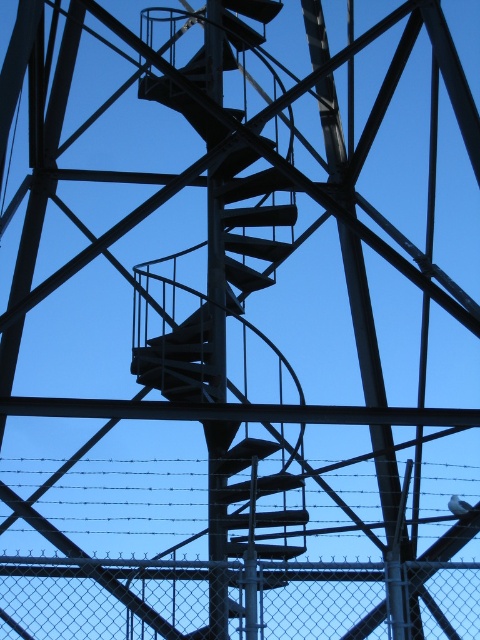
Is metallic spiral staircase at center behind barbed wire at center?

No.

Is metallic spiral staircase at center taller than barbed wire at center?

Yes, metallic spiral staircase at center is taller than barbed wire at center.

You are a GUI agent. You are given a task and a screenshot of the screen. Output one action in this format:
    pyautogui.click(x=<x>, y=<y>)
    Task: Click on the metallic spiral staircase at center
    The image size is (480, 640).
    Given the screenshot: What is the action you would take?
    pyautogui.click(x=218, y=289)

Which is more to the right, chain link fence at lower center or barbed wire at center?

chain link fence at lower center is more to the right.

Does chain link fence at lower center have a lesser width compared to barbed wire at center?

Yes.

Between point (477, 604) and point (192, 490), which one is positioned behind?

The point (192, 490) is behind.

Locate an element on the screen. chain link fence at lower center is located at coordinates (108, 593).

Between metallic spiral staircase at center and chain link fence at center, which one appears on the right side from the viewer's perspective?

From the viewer's perspective, chain link fence at center appears more on the right side.

In order to click on metallic spiral staircase at center in this screenshot , I will do `click(218, 289)`.

Locate an element on the screen. metallic spiral staircase at center is located at coordinates (218, 289).